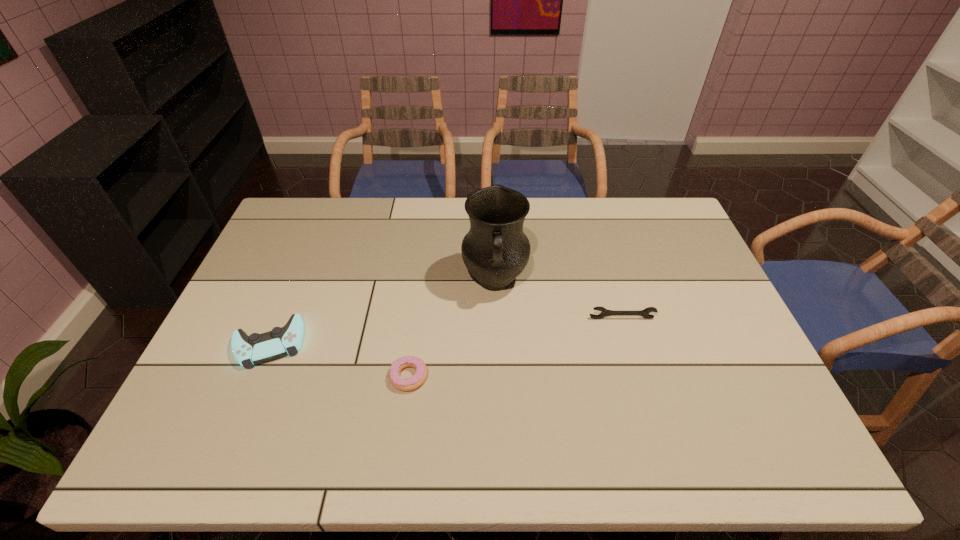
Image resolution: width=960 pixels, height=540 pixels. I want to click on vacant region between the control and the doughnut, so click(339, 360).

This screenshot has height=540, width=960. I want to click on free area in between the farthest object and the second object from left to right, so click(x=452, y=328).

Where is `unoccupied area between the rightmost object and the leftmost object`? unoccupied area between the rightmost object and the leftmost object is located at coordinates (445, 331).

Locate an element on the screen. Image resolution: width=960 pixels, height=540 pixels. vacant space that's between the control and the second object from right to left is located at coordinates (382, 312).

I want to click on free space between the doughnut and the wrench, so click(x=516, y=347).

This screenshot has height=540, width=960. What are the coordinates of `free space between the control and the wrench` in the screenshot? It's located at (445, 331).

Where is `free space between the third nearest object and the control`? This screenshot has width=960, height=540. free space between the third nearest object and the control is located at coordinates (445, 331).

Find the location of a particular element. free space between the third object from left to right and the wrench is located at coordinates (559, 299).

Identify which object is the closest to the leftmost object. Please provide its 2D coordinates. Your answer should be formatted as a tuple, i.e. [(x, y)], where the tuple contains the x and y coordinates of a point satisfying the conditions above.

[(404, 384)]

You are a GUI agent. You are given a task and a screenshot of the screen. Output one action in this format:
    pyautogui.click(x=<x>, y=<y>)
    Task: Click on the second closest object to the second object from right to left
    The image size is (960, 540).
    Given the screenshot: What is the action you would take?
    [404, 384]